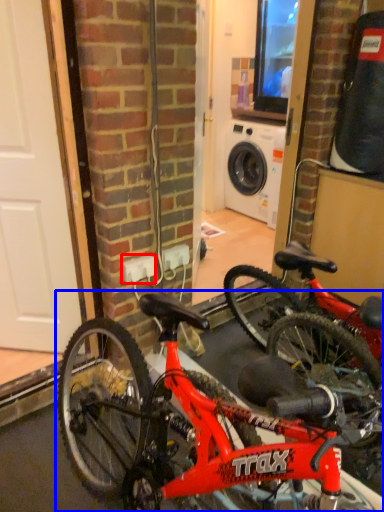
Question: Which object appears closest to the camera in this image, electric outlet (highlighted by a red box) or bicycle (highlighted by a blue box)?

Choices:
 (A) electric outlet
 (B) bicycle

Answer: (B)